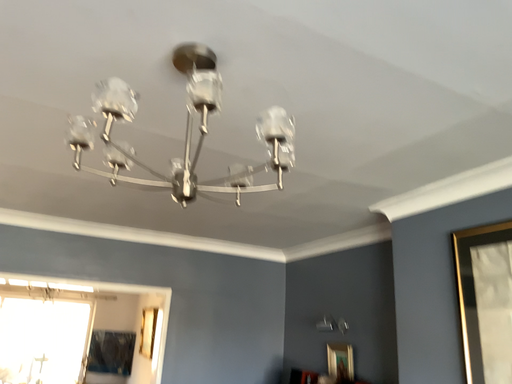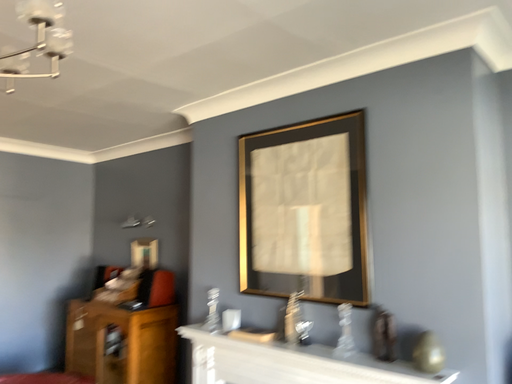
Question: Which way did the camera rotate in the video?

Choices:
 (A) rotated downward
 (B) rotated upward

Answer: (A)